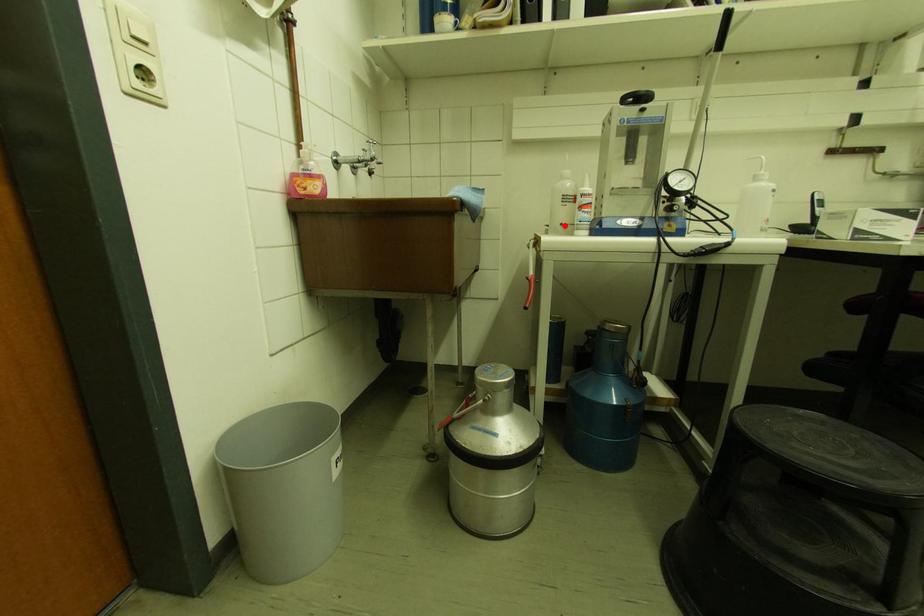
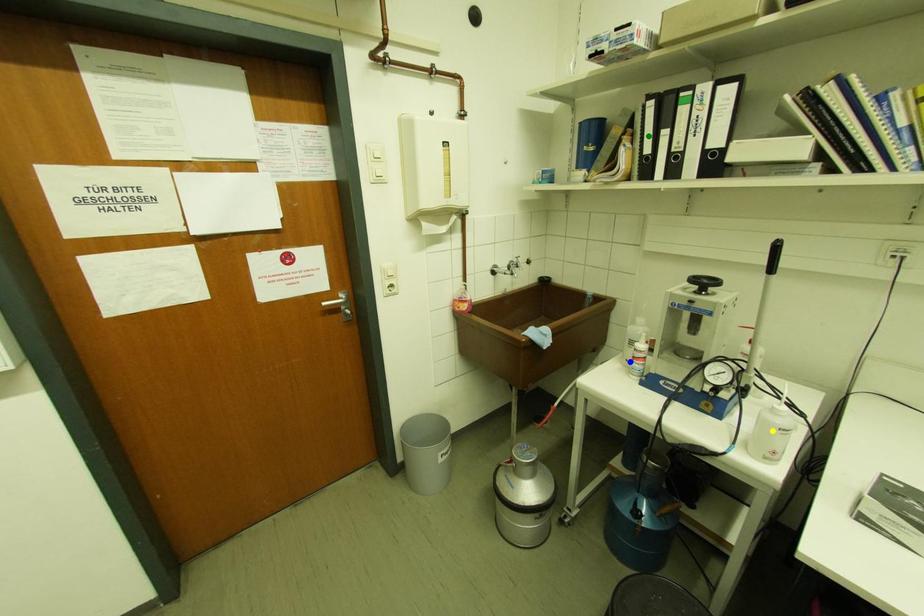
Question: I am providing you with two images of the same scene from different viewpoints. A red point is marked on the first image. You are given multiple points on the second image. Can you choose the point in image 2 that corresponds to the point in image 1?

Choices:
 (A) green point
 (B) yellow point
 (C) blue point

Answer: (C)